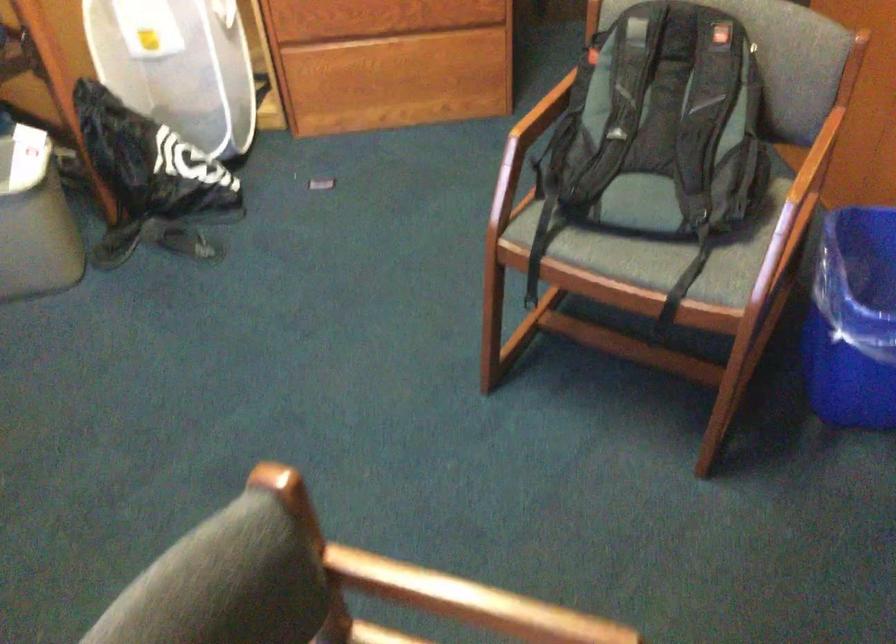
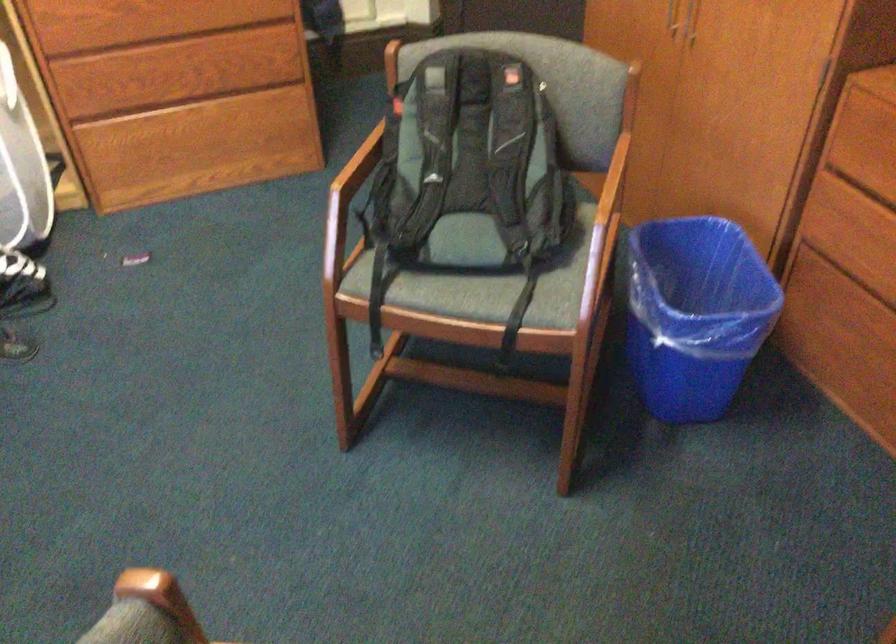
Question: The camera is either moving clockwise (left) or counter-clockwise (right) around the object. The first image is from the beginning of the video and the second image is from the end. Is the camera moving left or right when shooting the video?

Choices:
 (A) Left
 (B) Right

Answer: (A)